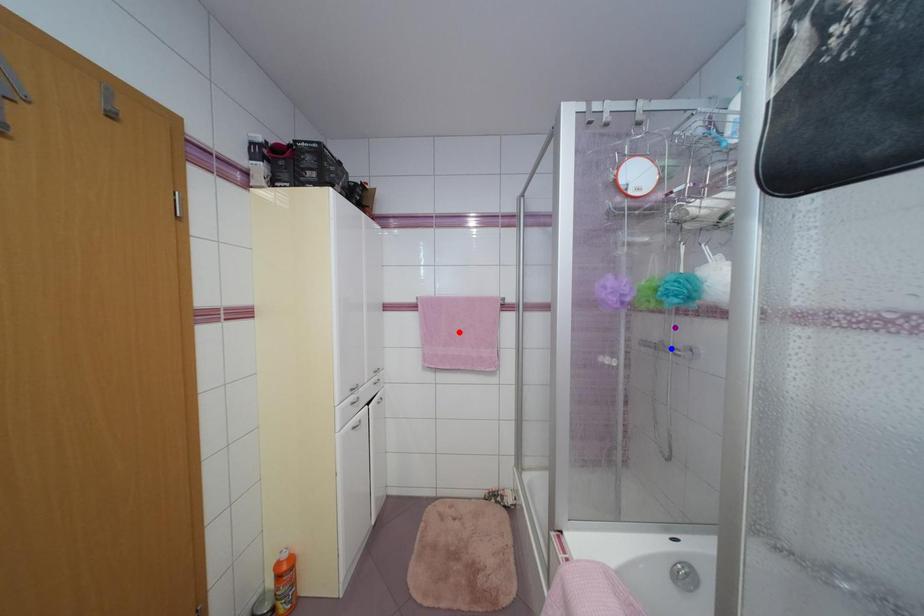
Order these from nearest to farthest:
blue point | purple point | red point

red point, blue point, purple point